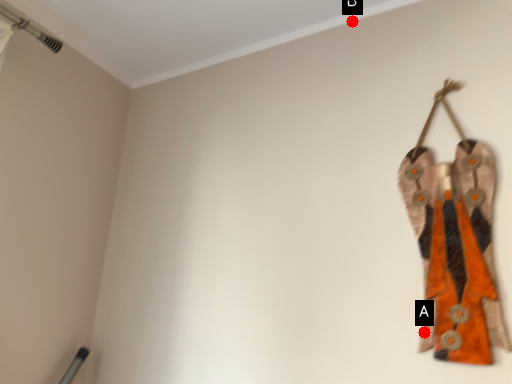
Question: Two points are circled on the image, labeled by A and B beside each circle. Which point is farther to the camera?

Choices:
 (A) A is further
 (B) B is further

Answer: (B)